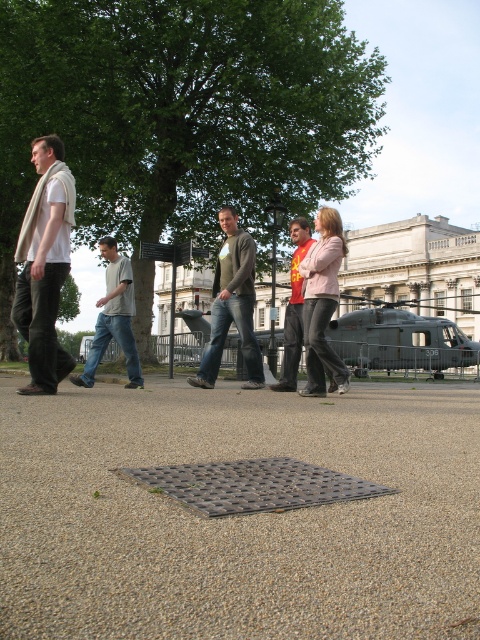
Does point (417, 381) come behind point (253, 355)?

Yes, it is.

Who is more forward, (133,586) or (245,253)?

Point (133,586) is more forward.

Find the location of a particular element. Image resolution: width=480 pixels, height=640 pixels. gray textured pavement at center is located at coordinates coord(239,516).

Between gray textured pavement at center and light gray cotton shirt at center, which one appears on the left side from the viewer's perspective?

Positioned to the left is light gray cotton shirt at center.

Between gray textured pavement at center and light gray cotton shirt at center, which one is positioned higher?

light gray cotton shirt at center is higher up.

Does point (219, 593) lie behind point (103, 252)?

No, (219, 593) is in front of (103, 252).

The height and width of the screenshot is (640, 480). I want to click on gray textured pavement at center, so click(x=239, y=516).

Is gray textured pavement at center taller than dark gray concrete helicopter at center?

In fact, gray textured pavement at center may be shorter than dark gray concrete helicopter at center.

Who is more forward, (129, 451) or (420, 253)?

Point (129, 451) is more forward.

Locate an element on the screen. The image size is (480, 640). gray textured pavement at center is located at coordinates (239, 516).